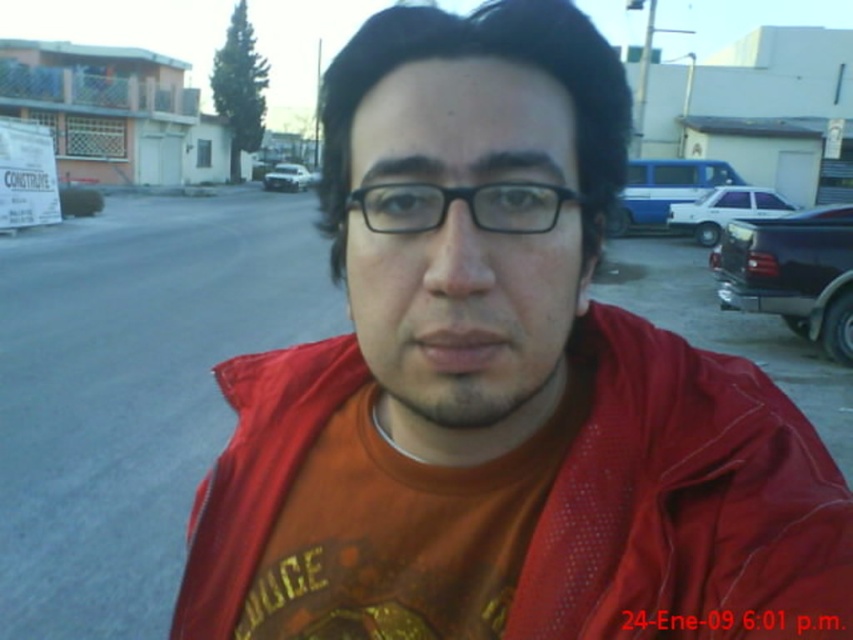
Question: Which object is positioned closest to the white matte car at center?

Choices:
 (A) white glossy sedan at right
 (B) dark blue metallic truck at right
 (C) blue metallic car at upper right

Answer: (C)

Question: Is dark blue metallic truck at right positioned behind white glossy sedan at right?

Choices:
 (A) no
 (B) yes

Answer: (A)

Question: Among these objects, which one is farthest from the camera?

Choices:
 (A) black plastic glasses at center
 (B) blue metallic car at upper right
 (C) white matte car at center

Answer: (C)

Question: Which of the following is the farthest from the observer?

Choices:
 (A) white glossy sedan at right
 (B) white matte car at center
 (C) dark blue metallic truck at right

Answer: (B)

Question: Considering the relative positions of blue metallic car at upper right and white matte car at center in the image provided, where is blue metallic car at upper right located with respect to white matte car at center?

Choices:
 (A) left
 (B) right

Answer: (B)

Question: Does blue metallic car at upper right have a larger size compared to white matte car at center?

Choices:
 (A) no
 (B) yes

Answer: (B)